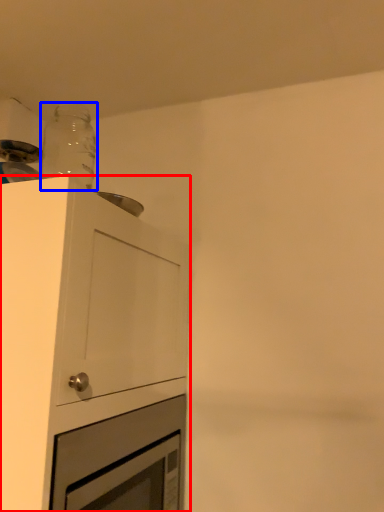
Question: Which point is closer to the camera, cabinetry (highlighted by a red box) or bottle (highlighted by a blue box)?

Choices:
 (A) cabinetry
 (B) bottle

Answer: (A)